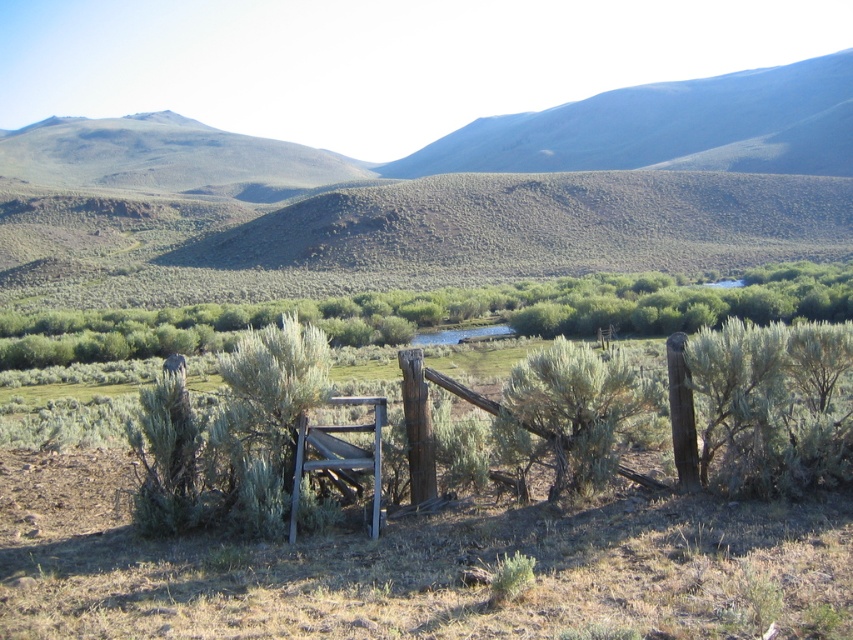
Does point (758, 88) come behind point (596, 369)?

Yes, point (758, 88) is farther from viewer.

In the scene shown: Measure the distance between point [682,179] and camera.

Point [682,179] is 401.02 feet from camera.

I want to click on green grassy hill at center, so click(x=434, y=195).

What do you see at coordinates (579, 412) in the screenshot? I see `green bushy shrub at center` at bounding box center [579, 412].

Does green bushy shrub at center appear on the left side of wooden chair at center?

A: No, green bushy shrub at center is not to the left of wooden chair at center.

What do you see at coordinates (579, 412) in the screenshot? I see `green bushy shrub at center` at bounding box center [579, 412].

Image resolution: width=853 pixels, height=640 pixels. Identify the location of green bushy shrub at center. (579, 412).

Can you confirm if green grassy hill at center is positioned to the right of wooden chair at center?

Incorrect, green grassy hill at center is not on the right side of wooden chair at center.

Which is more to the left, green grassy hill at center or wooden chair at center?

green grassy hill at center is more to the left.

This screenshot has height=640, width=853. In order to click on green grassy hill at center in this screenshot , I will do (x=434, y=195).